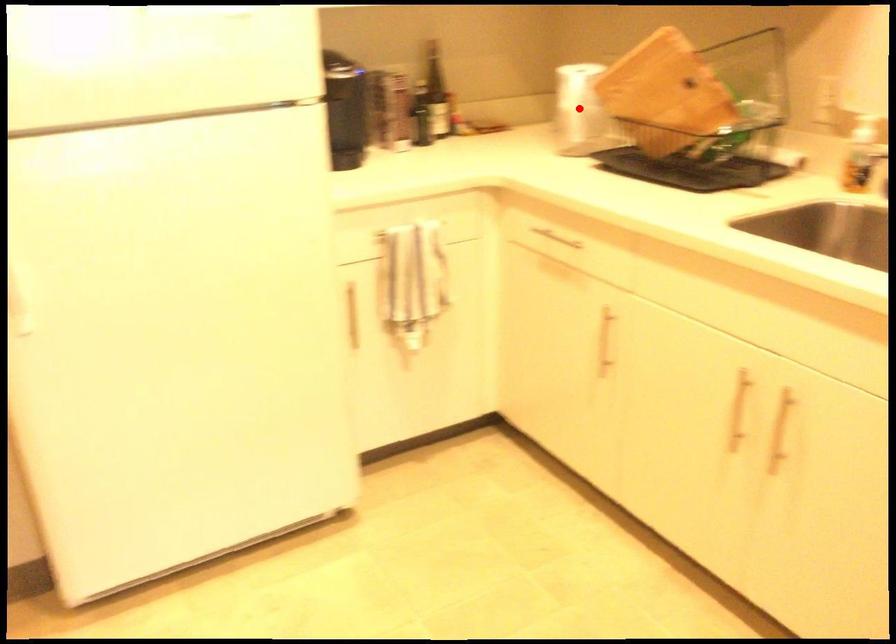
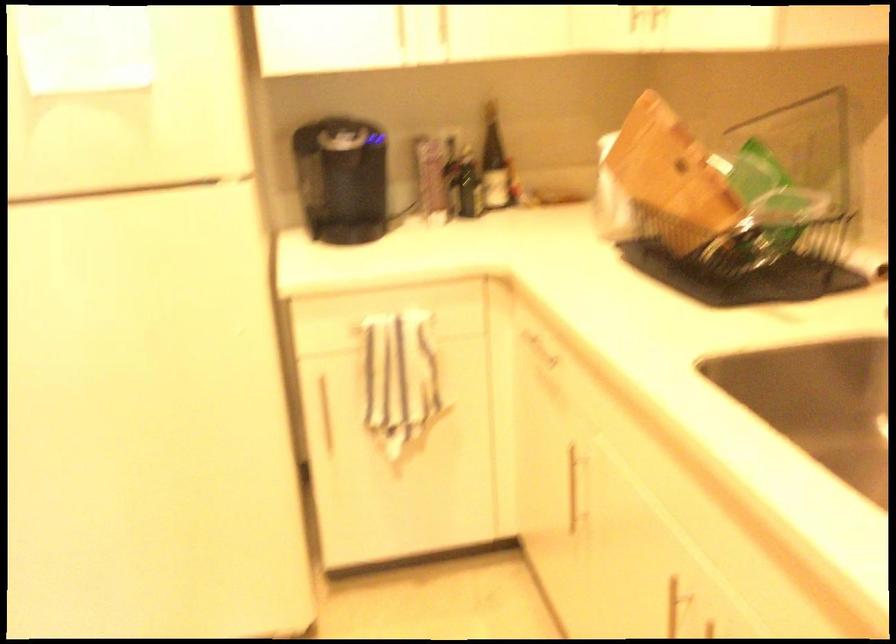
Question: I am providing you with two images of the same scene from different viewpoints. A red point is marked on the first image. Can you still see the location of the red point in image 2?

Choices:
 (A) Yes
 (B) No

Answer: (B)